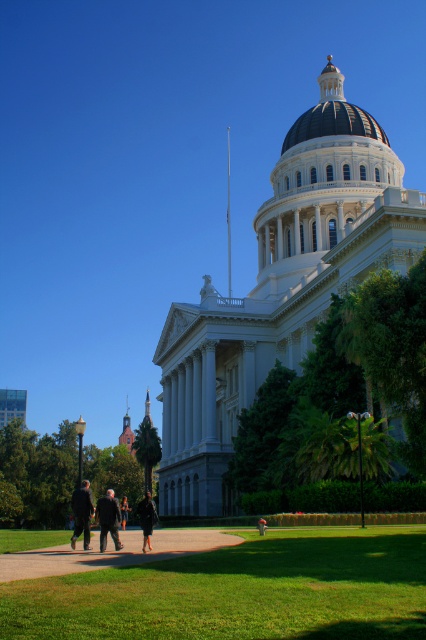
You are standing on the lawn in front of the grand neoclassical building. You see the blue glossy dome at upper center and the dark gray suit at lower left. Which object is closer to you?

The blue glossy dome at upper center is closer to you than the dark gray suit at lower left because it is further to the viewer.

You are planning to walk from the grassy sidewalk at lower center to the blue glossy dome at upper center. Considering their widths, which path would be more stable for walking?

The grassy sidewalk at lower center has a larger width than the blue glossy dome at upper center, so walking on the grassy sidewalk at lower center would be more stable.